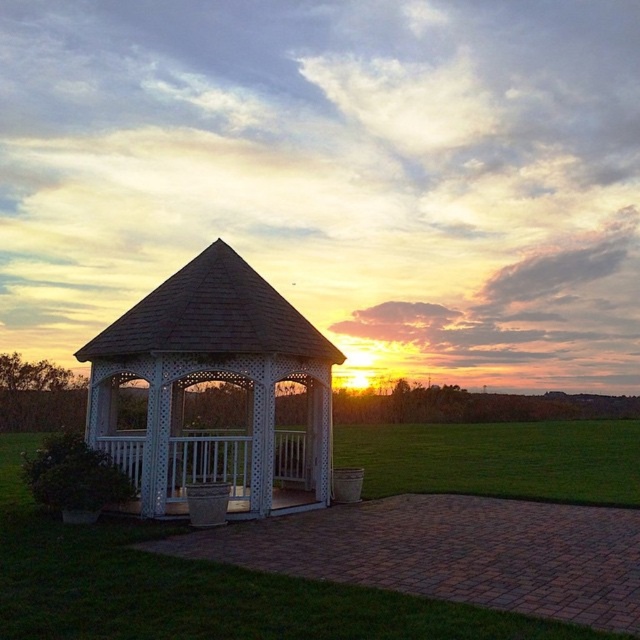
Question: Is green grass at center smaller than white lattice gazebo at center?

Choices:
 (A) no
 (B) yes

Answer: (A)

Question: Does green grass at center come in front of white lattice gazebo at center?

Choices:
 (A) yes
 (B) no

Answer: (A)

Question: Which point appears closest to the camera in this image?

Choices:
 (A) (308, 378)
 (B) (161, 608)

Answer: (B)

Question: Does green grass at center appear on the right side of white lattice gazebo at center?

Choices:
 (A) no
 (B) yes

Answer: (B)

Question: Which point is closer to the camera?

Choices:
 (A) white lattice gazebo at center
 (B) green grass at center

Answer: (B)

Question: Which point appears closest to the camera in this image?

Choices:
 (A) (305, 352)
 (B) (244, 611)

Answer: (B)